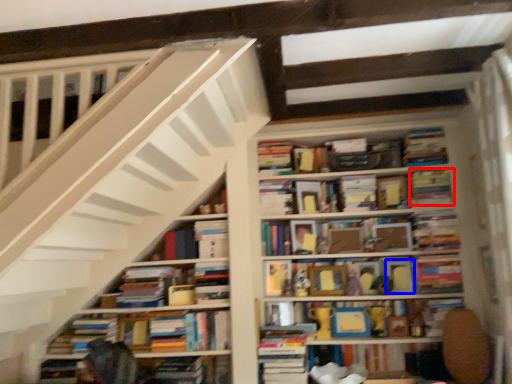
Question: Which object is further to the camera taking this photo, paperback book (highlighted by a red box) or paperback book (highlighted by a blue box)?

Choices:
 (A) paperback book
 (B) paperback book

Answer: (B)